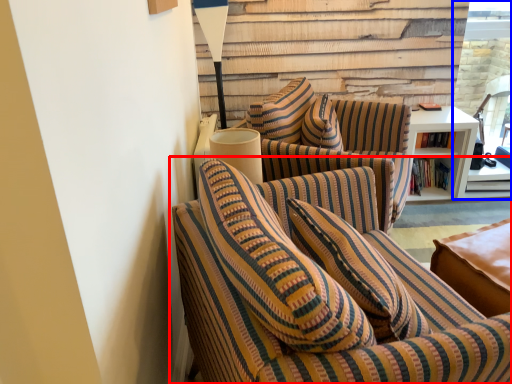
Question: Which object is closer to the camera taking this photo, studio couch (highlighted by a red box) or glass door (highlighted by a blue box)?

Choices:
 (A) studio couch
 (B) glass door

Answer: (A)